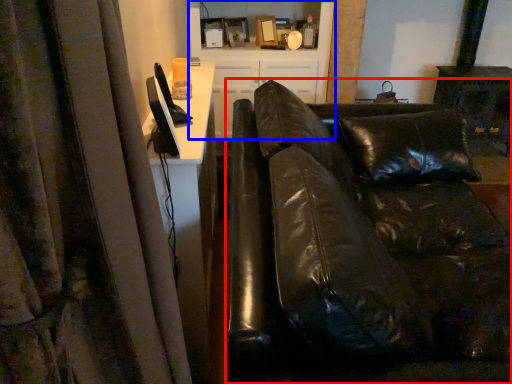
Question: Which point is further to the camera, studio couch (highlighted by a red box) or entertainment center (highlighted by a blue box)?

Choices:
 (A) studio couch
 (B) entertainment center

Answer: (B)